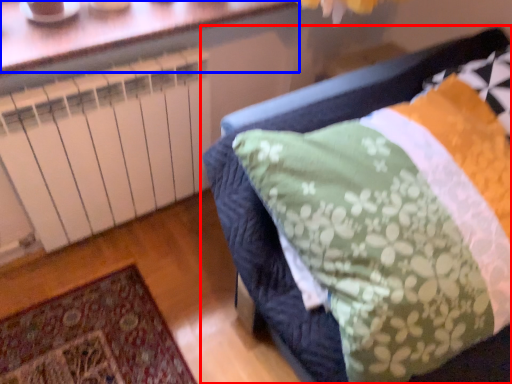
Question: Which of the following is the closest to the observer, furniture (highlighted by a red box) or window (highlighted by a blue box)?

Choices:
 (A) furniture
 (B) window

Answer: (A)